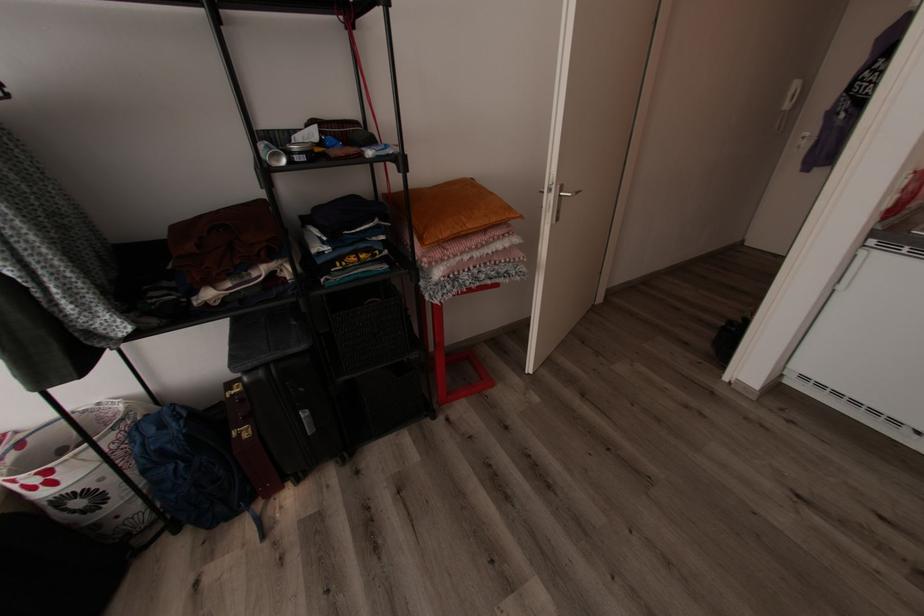
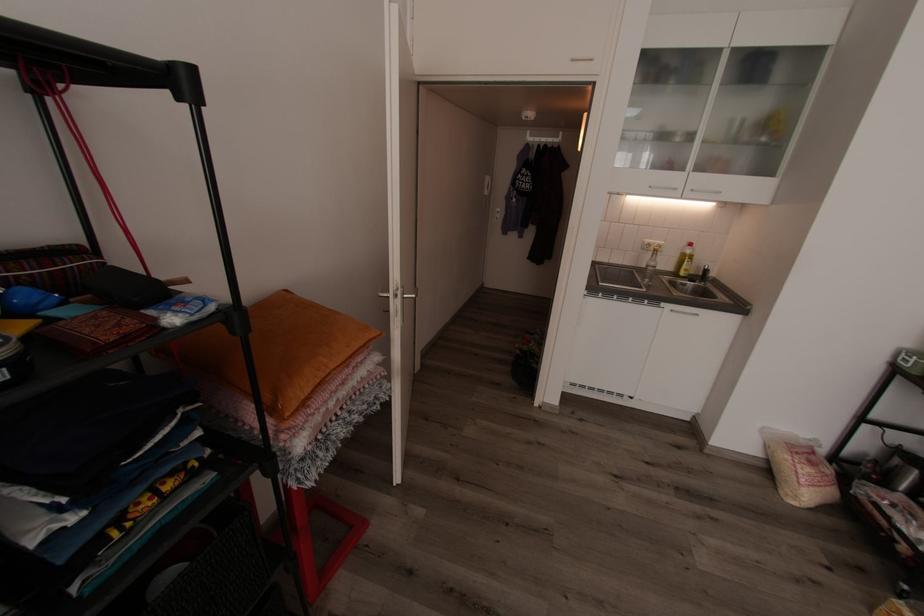
Question: The images are taken continuously from a first-person perspective. In which direction is your viewpoint rotating?

Choices:
 (A) Left
 (B) Right
 (C) Up
 (D) Down

Answer: (B)